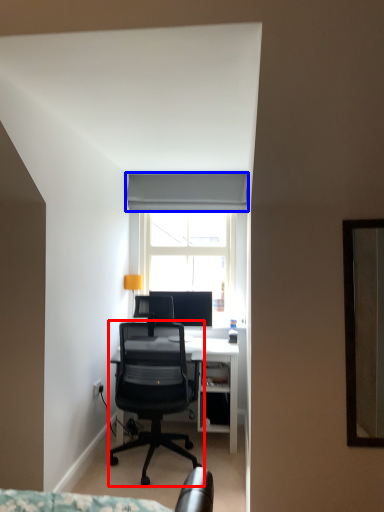
Question: Which object is closer to the camera taking this photo, chair (highlighted by a red box) or curtain (highlighted by a blue box)?

Choices:
 (A) chair
 (B) curtain

Answer: (A)